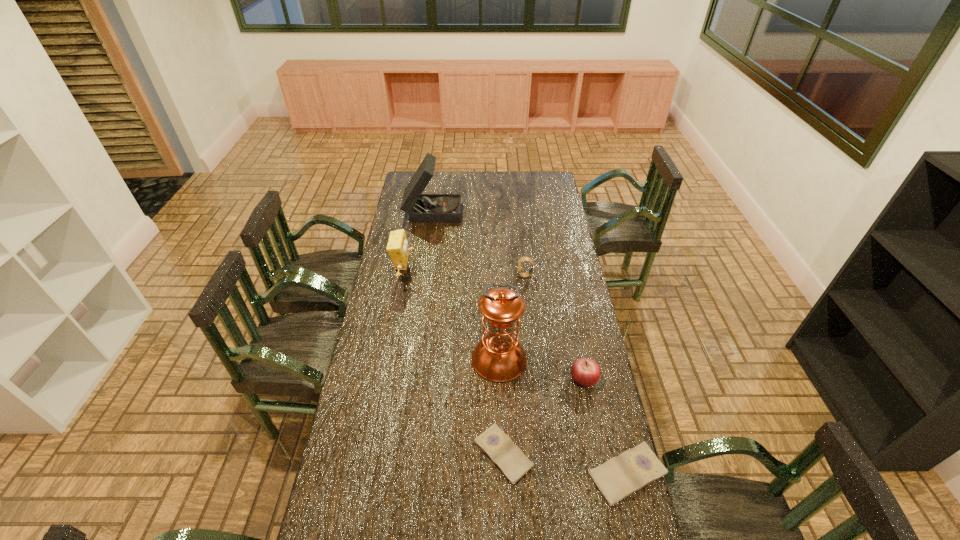
This screenshot has height=540, width=960. What are the coordinates of `free space located on the left of the left diary` in the screenshot? It's located at (387, 454).

Locate an element on the screen. The width and height of the screenshot is (960, 540). free space located 0.170m on the left of the right diary is located at coordinates (534, 474).

The height and width of the screenshot is (540, 960). Find the location of `free space located on the front-facing side of the phonograph_record`. free space located on the front-facing side of the phonograph_record is located at coordinates click(489, 210).

Identify the location of vacant space located on the face of the third tallest object. (455, 274).

The width and height of the screenshot is (960, 540). In order to click on vacant area located 0.050m on the front of the apple in this screenshot , I will do `click(588, 403)`.

Identify the location of free space located 0.270m on the face of the watch. (459, 275).

Locate an element on the screen. Image resolution: width=960 pixels, height=540 pixels. free space located 0.180m on the face of the watch is located at coordinates (479, 275).

Identify the location of vacant space located on the face of the watch. (444, 275).

The width and height of the screenshot is (960, 540). Identify the location of vacant space located 0.380m on the back of the oil lamp. (496, 273).

Locate an element on the screen. phonograph_record that is at the left edge is located at coordinates (423, 208).